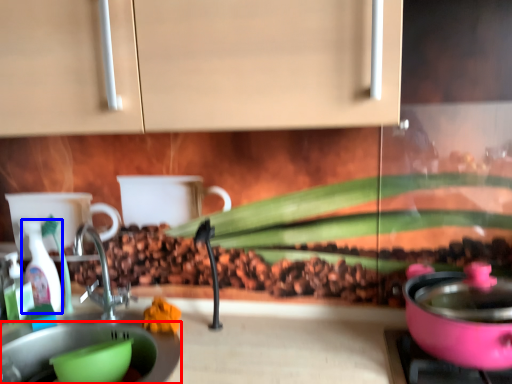
Question: Which object appears farthest to the camera in this image, sink (highlighted by a red box) or bottle (highlighted by a blue box)?

Choices:
 (A) sink
 (B) bottle

Answer: (B)